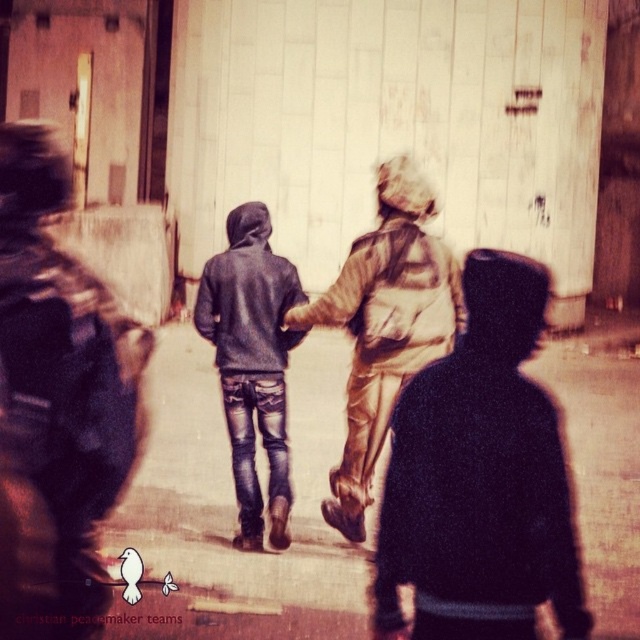
You are a delivery robot with a 5.5 feet wide package. You need to pass between the black matte jacket at lower right and the dark gray hoodie at center. Can you fit through the space between them?

The distance between the black matte jacket at lower right and the dark gray hoodie at center is 6.08 feet. Since your package is 5.5 feet wide, you can fit through the space between them as there is enough clearance.

You are a photographer trying to capture a group photo of the black matte jacket at lower right and the matte gray hoodie at center. If you want to ensure both subjects are fully visible in the frame, which subject should you position closer to the camera to avoid cropping?

Since the black matte jacket at lower right is narrower than the matte gray hoodie at center, positioning the matte gray hoodie at center closer to the camera would allow both subjects to fit without cropping, as wider objects need more space when closer.